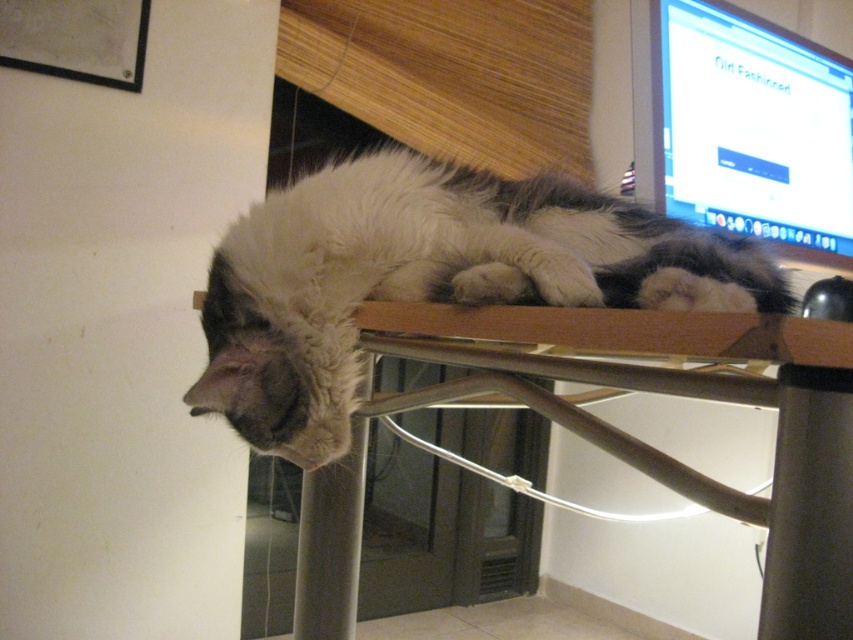
Question: Is white fluffy cat at center closer to the viewer compared to matte plastic monitor at upper right?

Choices:
 (A) no
 (B) yes

Answer: (B)

Question: Which object is farther from the camera taking this photo?

Choices:
 (A) wooden at upper center
 (B) white fluffy cat at center

Answer: (B)

Question: Is white fluffy cat at center above matte plastic monitor at upper right?

Choices:
 (A) no
 (B) yes

Answer: (A)

Question: Which point is farther from the camera taking this photo?

Choices:
 (A) (316, 360)
 (B) (457, 314)

Answer: (A)

Question: Is white fluffy cat at center further to the viewer compared to matte plastic monitor at upper right?

Choices:
 (A) no
 (B) yes

Answer: (A)

Question: Which point is farther to the camera?

Choices:
 (A) (788, 448)
 (B) (570, 234)
 (C) (753, 26)

Answer: (C)